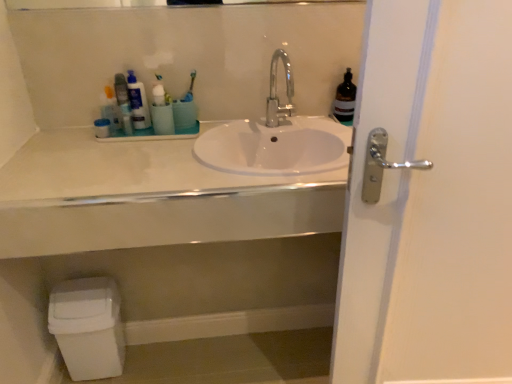
Where is `vacant space to the left of polished chrome faucet at center`? The height and width of the screenshot is (384, 512). vacant space to the left of polished chrome faucet at center is located at coordinates (246, 136).